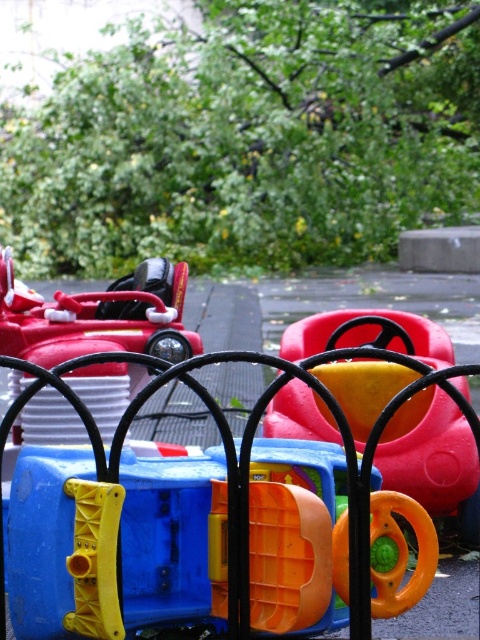
Question: Can you confirm if blue plastic steering wheel at center is positioned above shiny red car at center?

Choices:
 (A) yes
 (B) no

Answer: (B)

Question: Which point is closer to the camera taking this photo?

Choices:
 (A) (345, 316)
 (B) (414, 600)
 (C) (15, 307)

Answer: (B)

Question: Based on their relative distances, which object is nearer to the shiny red car at center?

Choices:
 (A) blue plastic steering wheel at center
 (B) rubberized yellow steering wheel at center

Answer: (B)

Question: Which point appears farthest from the camera in this image?

Choices:
 (A) (304, 486)
 (B) (414, 406)
 (C) (81, 317)

Answer: (C)

Question: Is blue plastic steering wheel at center below rubberized yellow steering wheel at center?

Choices:
 (A) no
 (B) yes

Answer: (B)

Question: Is blue plastic steering wheel at center to the right of rubberized yellow steering wheel at center from the viewer's perspective?

Choices:
 (A) yes
 (B) no

Answer: (B)